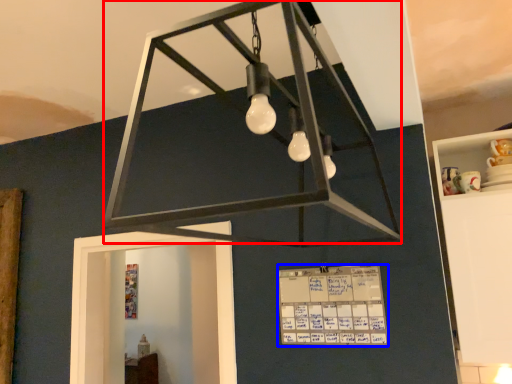
Question: Which object appears closest to the camera in this image, lamp (highlighted by a red box) or writing (highlighted by a blue box)?

Choices:
 (A) lamp
 (B) writing

Answer: (A)